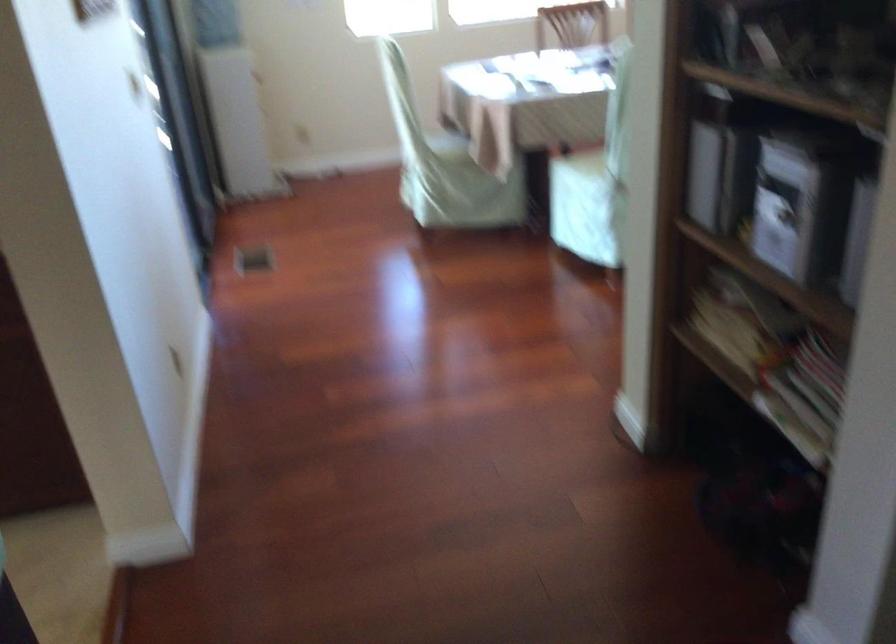
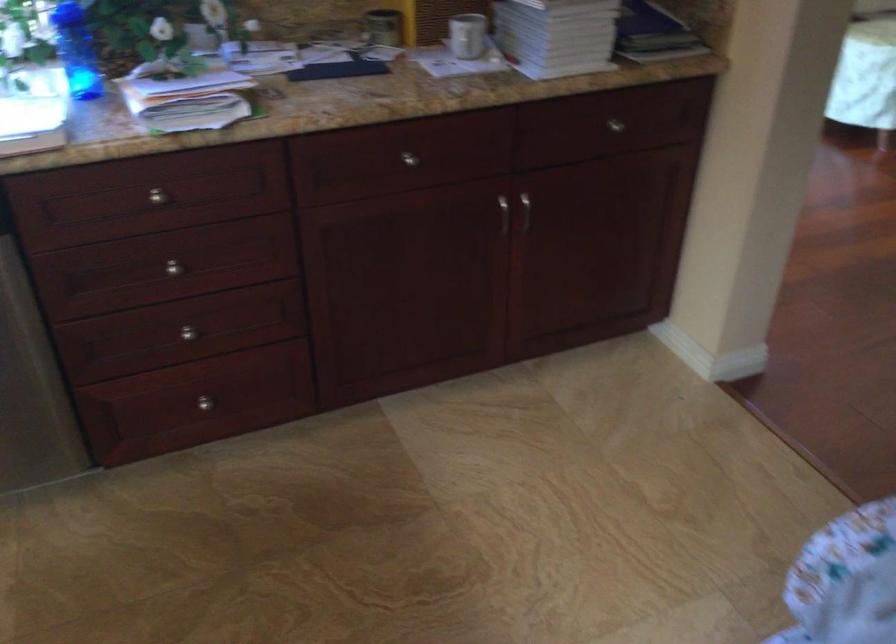
Question: The images are taken continuously from a first-person perspective. In which direction are you moving?

Choices:
 (A) Left
 (B) Right
 (C) Forward
 (D) Backward

Answer: (A)